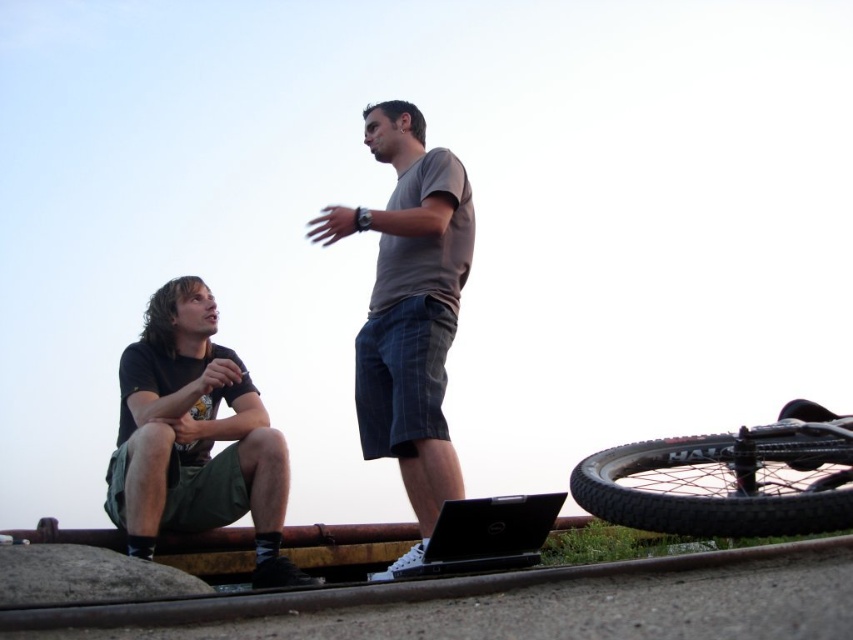
You are a photographer trying to capture a candid shot of the two people in the scene. You notice the dark green cotton shorts at left and the black rubber tire at lower right. Which object should you avoid placing in the foreground to prevent blocking the subjects?

You should avoid placing the dark green cotton shorts at left in the foreground because it is larger than the black rubber tire at lower right and could obstruct the view of the subjects.

You are standing at the camera position and want to place a 6 meter long ladder between you and the black rubber tire at lower right. Is the distance sufficient to fit the ladder horizontally?

The distance between the black rubber tire at lower right and the camera is 5.36 meters. Since the ladder is 6 meters long, it is longer than the available space, so the ladder cannot be placed horizontally in that area.